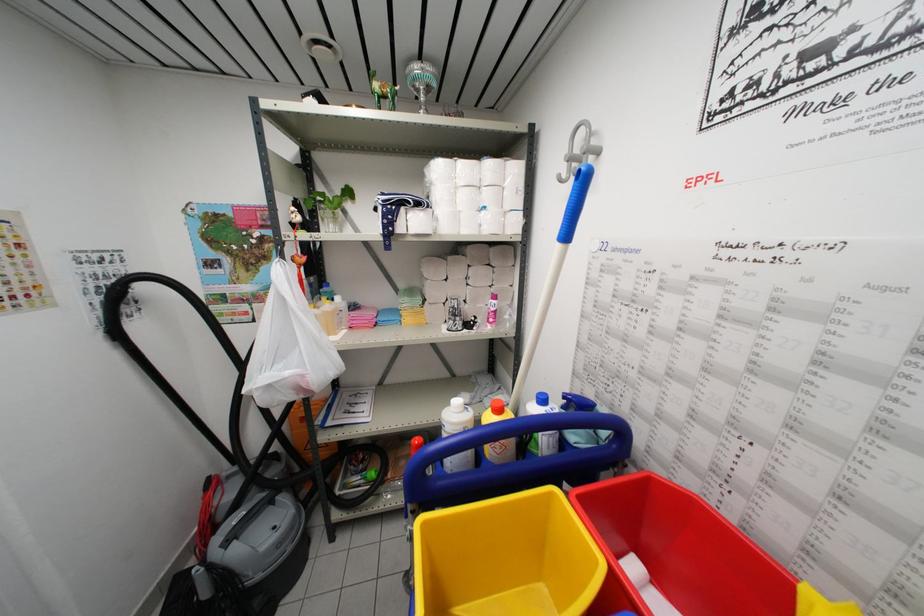
Image resolution: width=924 pixels, height=616 pixels. Describe the element at coordinates (578, 150) in the screenshot. I see `the spray bottle trigger` at that location.